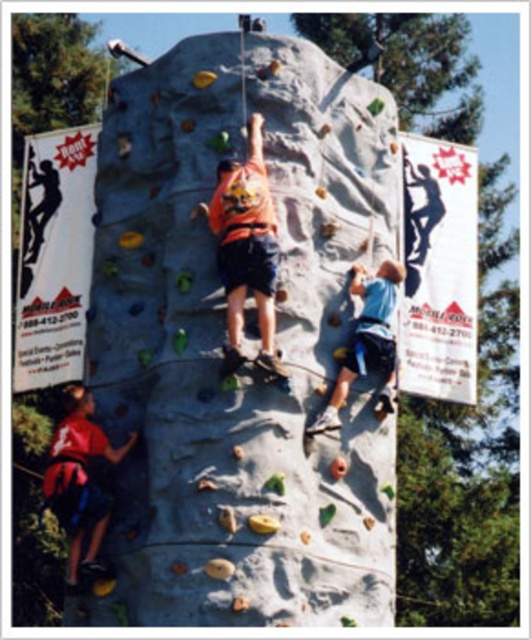
Question: Is orange fabric shirt at center further to camera compared to matte red shirt at lower left?

Choices:
 (A) yes
 (B) no

Answer: (B)

Question: Which object is the farthest from the orange fabric shirt at center?

Choices:
 (A) blue fabric climbing harness at lower right
 (B) smooth gray rock climbing wall at center
 (C) matte red shirt at lower left

Answer: (C)

Question: In this image, where is orange fabric shirt at center located relative to matte red shirt at lower left?

Choices:
 (A) below
 (B) above

Answer: (B)

Question: Considering the real-world distances, which object is farthest from the blue fabric climbing harness at lower right?

Choices:
 (A) orange fabric shirt at center
 (B) matte red shirt at lower left
 (C) smooth gray rock climbing wall at center

Answer: (B)

Question: Which point is farther to the camera?

Choices:
 (A) (97, 499)
 (B) (355, 278)
 (C) (226, 192)
 (D) (375, 209)

Answer: (D)

Question: Is smooth gray rock climbing wall at center closer to camera compared to orange fabric shirt at center?

Choices:
 (A) no
 (B) yes

Answer: (B)